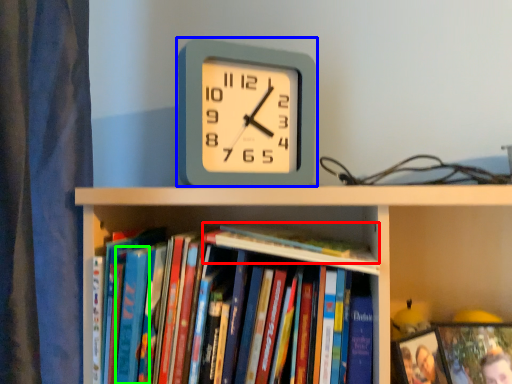
Question: Estimate the real-world distances between objects in this image. Which object is farther from book (highlighted by a red box), wall clock (highlighted by a blue box) or paperback book (highlighted by a green box)?

Choices:
 (A) wall clock
 (B) paperback book

Answer: (B)